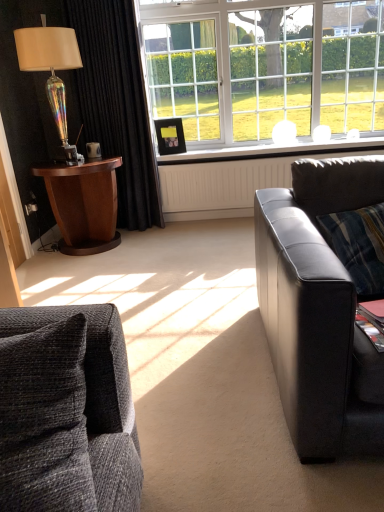
Question: Is point coord(336,198) positioned closer to the camera than point coord(86,224)?

Choices:
 (A) farther
 (B) closer

Answer: (B)

Question: From a real-world perspective, is black leather couch at right, which is counted as the second studio couch, starting from the front, positioned above or below wooden side table at left?

Choices:
 (A) above
 (B) below

Answer: (A)

Question: Estimate the real-world distances between objects in this image. Which object is closer to the clear glass window at upper center?

Choices:
 (A) black plastic power outlet at lower left
 (B) textured gray couch at lower left, positioned as the 2th studio couch in back-to-front order
 (C) wooden picture frame at upper center
 (D) wooden side table at left
 (E) iridescent glass lamp at left

Answer: (D)

Question: Based on their relative distances, which object is farther from the wooden picture frame at upper center?

Choices:
 (A) white plastic window sill at center
 (B) clear glass window at upper center
 (C) textured gray couch at lower left, positioned as the second studio couch in right-to-left order
 (D) black velvet curtain at left
 (E) black leather couch at right, which appears as the second studio couch when viewed from the left

Answer: (B)